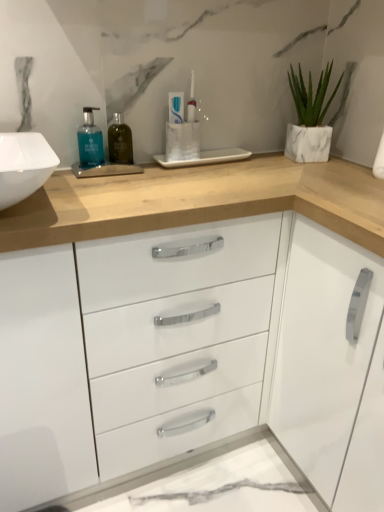
Question: Would you say white glossy cabinet handle at right is a long distance from green glass bottle at center, which appears as the 2th mouthwash when viewed from the left?

Choices:
 (A) no
 (B) yes

Answer: (A)

Question: From a real-world perspective, is white glossy cabinet handle at right under green glass bottle at center, which appears as the 2th mouthwash when viewed from the left?

Choices:
 (A) yes
 (B) no

Answer: (A)

Question: Considering the relative sizes of white glossy cabinet handle at right and green glass bottle at center, which ranks as the first mouthwash in right-to-left order, in the image provided, is white glossy cabinet handle at right wider than green glass bottle at center, which ranks as the first mouthwash in right-to-left order,?

Choices:
 (A) yes
 (B) no

Answer: (A)

Question: Could you tell me if white glossy cabinet handle at right is turned towards green glass bottle at center, which appears as the 2th mouthwash when viewed from the left?

Choices:
 (A) yes
 (B) no

Answer: (B)

Question: Is green glass bottle at center, which ranks as the first mouthwash in right-to-left order, located within white glossy cabinet handle at right?

Choices:
 (A) yes
 (B) no

Answer: (B)

Question: From the image's perspective, is white glossy cabinet handle at right above green glass bottle at center, which ranks as the first mouthwash in right-to-left order?

Choices:
 (A) no
 (B) yes

Answer: (A)

Question: From a real-world perspective, is white marble planter at upper right on green glass bottle at center, which ranks as the first mouthwash in right-to-left order?

Choices:
 (A) yes
 (B) no

Answer: (A)

Question: Is white marble planter at upper right bigger than green glass bottle at center, which appears as the 2th mouthwash when viewed from the left?

Choices:
 (A) yes
 (B) no

Answer: (A)

Question: Does white marble planter at upper right have a greater width compared to green glass bottle at center, which ranks as the first mouthwash in right-to-left order?

Choices:
 (A) no
 (B) yes

Answer: (B)

Question: Is white marble planter at upper right positioned before green glass bottle at center, which appears as the 2th mouthwash when viewed from the left?

Choices:
 (A) no
 (B) yes

Answer: (A)

Question: Is white marble planter at upper right turned away from green glass bottle at center, which ranks as the first mouthwash in right-to-left order?

Choices:
 (A) no
 (B) yes

Answer: (A)

Question: From the image's perspective, is white marble planter at upper right on top of green glass bottle at center, which appears as the 2th mouthwash when viewed from the left?

Choices:
 (A) yes
 (B) no

Answer: (A)

Question: Could you tell me if white marble planter at upper right is turned towards white glossy toothpaste at center?

Choices:
 (A) no
 (B) yes

Answer: (A)